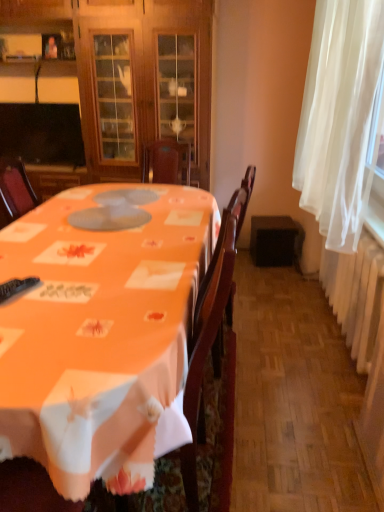
Question: Would you say black plastic remote control at lower left is a long distance from orange fabric table at center?

Choices:
 (A) no
 (B) yes

Answer: (A)

Question: Is black plastic remote control at lower left facing away from orange fabric table at center?

Choices:
 (A) no
 (B) yes

Answer: (B)

Question: From a real-world perspective, is black plastic remote control at lower left on top of orange fabric table at center?

Choices:
 (A) no
 (B) yes

Answer: (B)

Question: Is black plastic remote control at lower left oriented towards orange fabric table at center?

Choices:
 (A) no
 (B) yes

Answer: (B)

Question: Is orange fabric table at center surrounded by black plastic remote control at lower left?

Choices:
 (A) no
 (B) yes

Answer: (A)

Question: Is point (14, 288) positioned closer to the camera than point (193, 162)?

Choices:
 (A) closer
 (B) farther

Answer: (A)

Question: In terms of height, does black plastic remote control at lower left look taller or shorter compared to wooden cabinet at center?

Choices:
 (A) tall
 (B) short

Answer: (B)

Question: Would you say black plastic remote control at lower left is to the left or to the right of wooden cabinet at center in the picture?

Choices:
 (A) right
 (B) left

Answer: (A)

Question: In the image, is black plastic remote control at lower left positioned in front of or behind wooden cabinet at center?

Choices:
 (A) behind
 (B) front

Answer: (B)

Question: Is wooden cabinet at center inside the boundaries of white sheer curtain at right, or outside?

Choices:
 (A) inside
 (B) outside

Answer: (B)

Question: Is wooden cabinet at center bigger or smaller than white sheer curtain at right?

Choices:
 (A) small
 (B) big

Answer: (B)

Question: From their relative heights in the image, would you say wooden cabinet at center is taller or shorter than white sheer curtain at right?

Choices:
 (A) short
 (B) tall

Answer: (B)

Question: From the image's perspective, is wooden cabinet at center located above or below white sheer curtain at right?

Choices:
 (A) below
 (B) above

Answer: (B)

Question: Does point (362, 82) appear closer or farther from the camera than point (102, 368)?

Choices:
 (A) closer
 (B) farther

Answer: (B)

Question: Is white sheer curtain at right bigger or smaller than orange fabric table at center?

Choices:
 (A) big
 (B) small

Answer: (B)